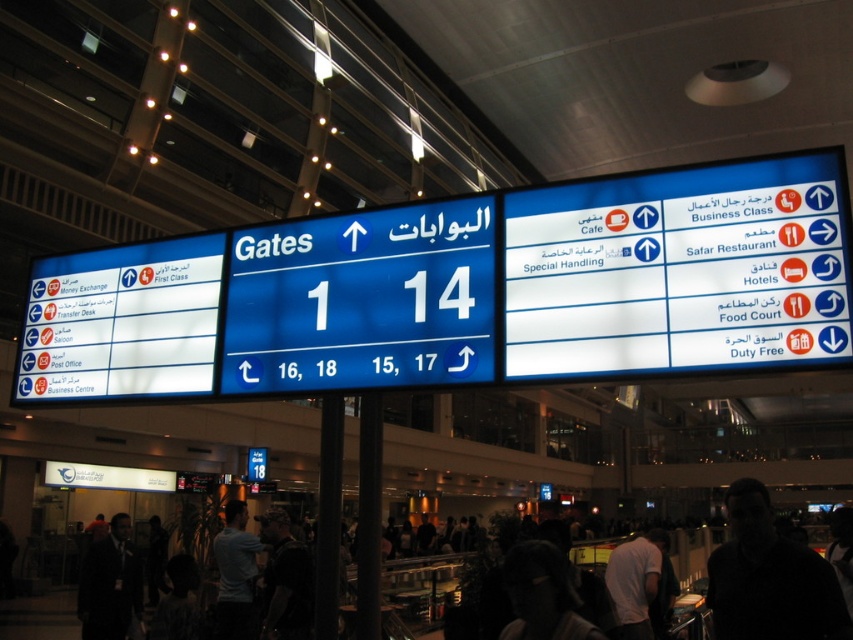
You are standing in an airport terminal and see the blue glossy signboard at center and the dark suit at lower left. Which object is larger in size?

The dark suit at lower left is larger than the blue glossy signboard at center.

You are standing in an airport terminal and see the blue glossy sign at center and the dark suit at lower left. Which object appears smaller in size?

The blue glossy sign at center has a smaller size compared to the dark suit at lower left, so the blue glossy sign at center appears smaller.